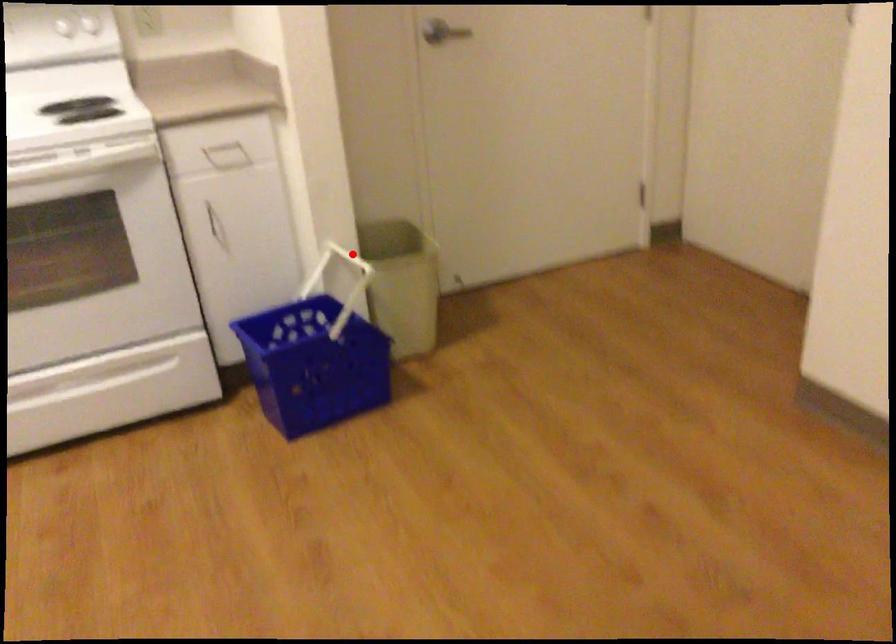
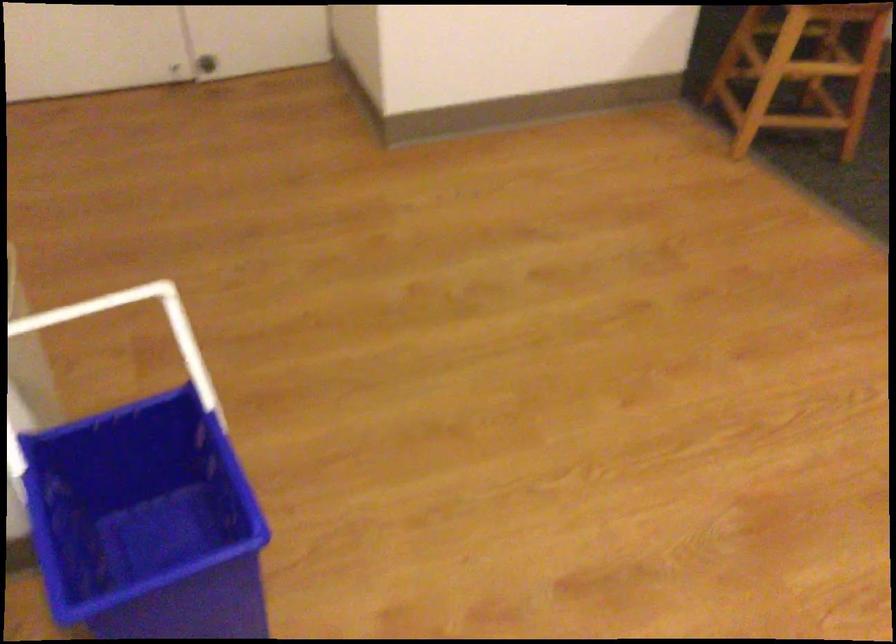
Find the pixel in the second image that matches the highlighted location in the first image.

(58, 316)